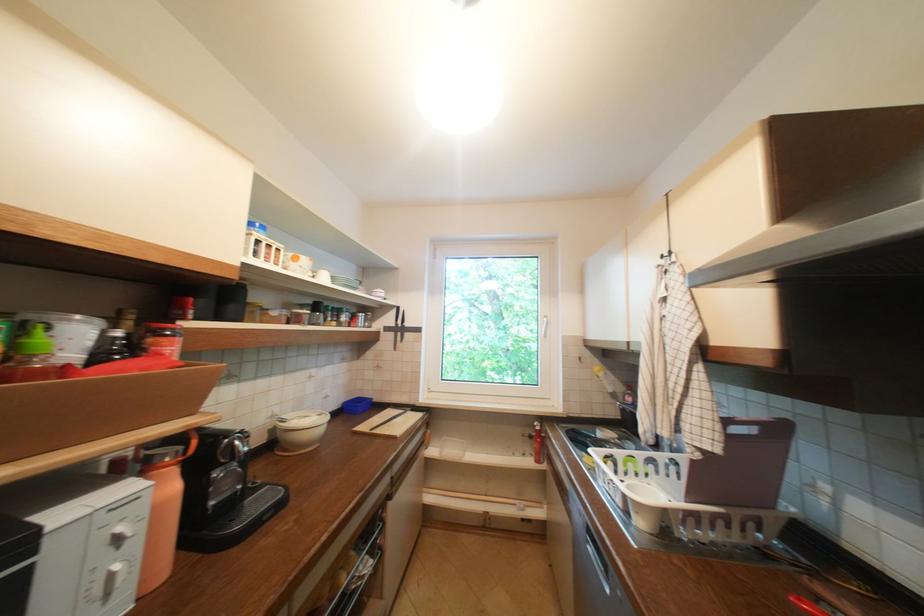
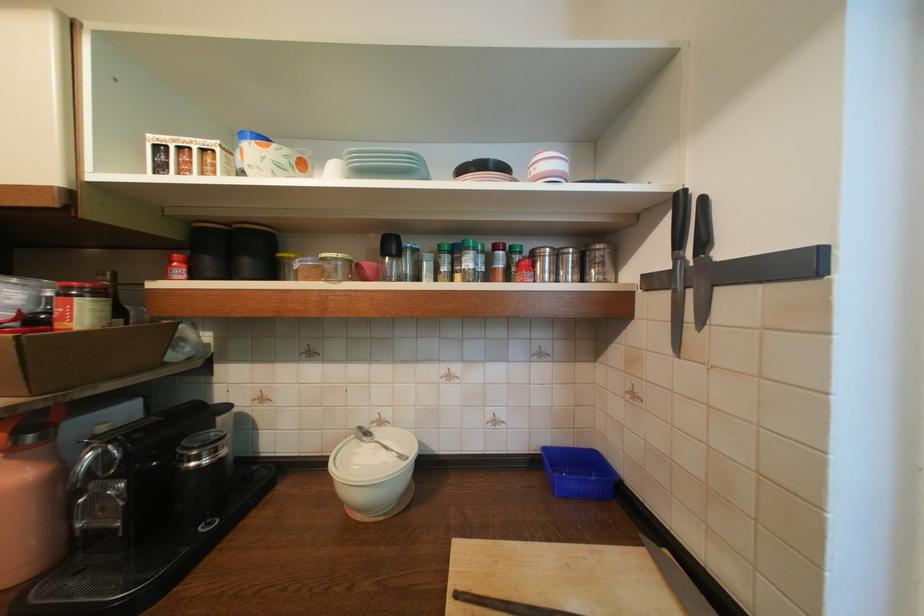
Where in the second image is the point corresponding to the point at 406,325 from the first image?

(686, 261)